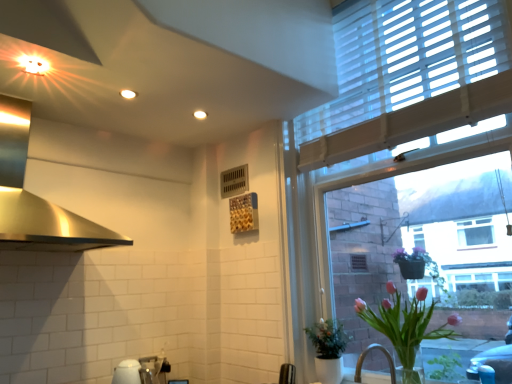
Where is `white glossy sink at lower center`? This screenshot has width=512, height=384. white glossy sink at lower center is located at coordinates (142, 371).

This screenshot has height=384, width=512. I want to click on white textured window at upper right, so click(x=411, y=156).

Describe the element at coordinates (405, 328) in the screenshot. I see `pink glass vase at lower right, marked as the second houseplant in a back-to-front arrangement` at that location.

The image size is (512, 384). In order to click on polished stainless steel exhaust hood at upper left in this screenshot , I will do `click(37, 198)`.

Is pink glass vase at lower right, marked as the second houseplant in a back-to-front arrangement, surrounded by polished stainless steel exhaust hood at upper left?

No, pink glass vase at lower right, marked as the second houseplant in a back-to-front arrangement, is located outside of polished stainless steel exhaust hood at upper left.

Who is more distant, polished stainless steel exhaust hood at upper left or pink glass vase at lower right, which is the first houseplant from front to back?

pink glass vase at lower right, which is the first houseplant from front to back, is further away from the camera.

Looking at this image, how many degrees apart are the facing directions of polished stainless steel exhaust hood at upper left and pink glass vase at lower right, which is the first houseplant from front to back?

The angular difference between polished stainless steel exhaust hood at upper left and pink glass vase at lower right, which is the first houseplant from front to back, is 88.5 degrees.

Considering the relative sizes of polished stainless steel exhaust hood at upper left and white glossy sink at lower center in the image provided, is polished stainless steel exhaust hood at upper left bigger than white glossy sink at lower center?

Yes.

Does polished stainless steel exhaust hood at upper left have a lesser width compared to white glossy sink at lower center?

No, polished stainless steel exhaust hood at upper left is not thinner than white glossy sink at lower center.

Does point (26, 216) come in front of point (161, 370)?

That is True.

From their relative heights in the image, would you say polished stainless steel exhaust hood at upper left is taller or shorter than white glossy sink at lower center?

Clearly, polished stainless steel exhaust hood at upper left is taller compared to white glossy sink at lower center.

Is pink glass vase at lower right, which is the first houseplant from front to back, spatially inside green matte plant at lower right, arranged as the first houseplant when viewed from the back, or outside of it?

pink glass vase at lower right, which is the first houseplant from front to back, is spatially situated outside green matte plant at lower right, arranged as the first houseplant when viewed from the back.

Which object is positioned more to the right, pink glass vase at lower right, which is the first houseplant from front to back, or green matte plant at lower right, the 2th houseplant viewed from the front?

pink glass vase at lower right, which is the first houseplant from front to back.

Could you tell me if pink glass vase at lower right, which is the first houseplant from front to back, is facing green matte plant at lower right, arranged as the first houseplant when viewed from the back?

No, pink glass vase at lower right, which is the first houseplant from front to back, does not turn towards green matte plant at lower right, arranged as the first houseplant when viewed from the back.

Considering the relative sizes of pink glass vase at lower right, which is the first houseplant from front to back, and green matte plant at lower right, arranged as the first houseplant when viewed from the back, in the image provided, is pink glass vase at lower right, which is the first houseplant from front to back, wider than green matte plant at lower right, arranged as the first houseplant when viewed from the back,?

Indeed, pink glass vase at lower right, which is the first houseplant from front to back, has a greater width compared to green matte plant at lower right, arranged as the first houseplant when viewed from the back.

The width and height of the screenshot is (512, 384). In order to click on window above the green matte plant at lower right, the 2th houseplant viewed from the front (from a real-world perspective) in this screenshot , I will do `click(411, 156)`.

From the image's perspective, is white textured window at upper right located above green matte plant at lower right, the 2th houseplant viewed from the front?

Yes, from the image's perspective, white textured window at upper right is above green matte plant at lower right, the 2th houseplant viewed from the front.

Does white textured window at upper right have a greater height compared to green matte plant at lower right, the 2th houseplant viewed from the front?

Correct, white textured window at upper right is much taller as green matte plant at lower right, the 2th houseplant viewed from the front.

Who is smaller, white textured window at upper right or green matte plant at lower right, arranged as the first houseplant when viewed from the back?

Smaller between the two is green matte plant at lower right, arranged as the first houseplant when viewed from the back.

Is pink glass vase at lower right, which is the first houseplant from front to back, bigger or smaller than polished stainless steel exhaust hood at upper left?

In the image, pink glass vase at lower right, which is the first houseplant from front to back, appears to be smaller than polished stainless steel exhaust hood at upper left.

Is pink glass vase at lower right, marked as the second houseplant in a back-to-front arrangement, in front of or behind polished stainless steel exhaust hood at upper left in the image?

Clearly, pink glass vase at lower right, marked as the second houseplant in a back-to-front arrangement, is behind polished stainless steel exhaust hood at upper left.

How many degrees apart are the facing directions of pink glass vase at lower right, marked as the second houseplant in a back-to-front arrangement, and polished stainless steel exhaust hood at upper left?

pink glass vase at lower right, marked as the second houseplant in a back-to-front arrangement, and polished stainless steel exhaust hood at upper left are facing 88.5 degrees away from each other.

Is green matte plant at lower right, the 2th houseplant viewed from the front, at the left side of white textured window at upper right?

Correct, you'll find green matte plant at lower right, the 2th houseplant viewed from the front, to the left of white textured window at upper right.

Does green matte plant at lower right, the 2th houseplant viewed from the front, turn towards white textured window at upper right?

Yes, green matte plant at lower right, the 2th houseplant viewed from the front, faces towards white textured window at upper right.

From the image's perspective, is green matte plant at lower right, the 2th houseplant viewed from the front, over white textured window at upper right?

No, from the image's perspective, green matte plant at lower right, the 2th houseplant viewed from the front, is not above white textured window at upper right.

Is white textured window at upper right located within green matte plant at lower right, the 2th houseplant viewed from the front?

No, white textured window at upper right is not inside green matte plant at lower right, the 2th houseplant viewed from the front.

Is green matte plant at lower right, arranged as the first houseplant when viewed from the back, touching polished stainless steel exhaust hood at upper left?

No, green matte plant at lower right, arranged as the first houseplant when viewed from the back, is not making contact with polished stainless steel exhaust hood at upper left.

From a real-world perspective, is green matte plant at lower right, the 2th houseplant viewed from the front, physically located above or below polished stainless steel exhaust hood at upper left?

green matte plant at lower right, the 2th houseplant viewed from the front, is situated lower than polished stainless steel exhaust hood at upper left in the real world.

Considering the sizes of objects green matte plant at lower right, arranged as the first houseplant when viewed from the back, and polished stainless steel exhaust hood at upper left in the image provided, who is taller, green matte plant at lower right, arranged as the first houseplant when viewed from the back, or polished stainless steel exhaust hood at upper left?

polished stainless steel exhaust hood at upper left.

Can you confirm if green matte plant at lower right, arranged as the first houseplant when viewed from the back, is smaller than polished stainless steel exhaust hood at upper left?

Yes.

Starting from the polished stainless steel exhaust hood at upper left, which houseplant is the 2nd one to the right? Please provide its 2D coordinates.

[(405, 328)]

This screenshot has height=384, width=512. Find the location of `exhaust hood on the left of white glossy sink at lower center`. exhaust hood on the left of white glossy sink at lower center is located at coordinates (37, 198).

When comparing their distances from white glossy sink at lower center, does pink glass vase at lower right, marked as the second houseplant in a back-to-front arrangement, or polished stainless steel exhaust hood at upper left seem further?

Among the two, pink glass vase at lower right, marked as the second houseplant in a back-to-front arrangement, is located further to white glossy sink at lower center.

In the scene shown: Looking at the image, which one is located further to polished stainless steel exhaust hood at upper left, green matte plant at lower right, the 2th houseplant viewed from the front, or white glossy sink at lower center?

green matte plant at lower right, the 2th houseplant viewed from the front, is further to polished stainless steel exhaust hood at upper left.

When comparing their distances from white textured window at upper right, does polished stainless steel exhaust hood at upper left or pink glass vase at lower right, which is the first houseplant from front to back, seem further?

Among the two, polished stainless steel exhaust hood at upper left is located further to white textured window at upper right.

Estimate the real-world distances between objects in this image. Which object is closer to white glossy sink at lower center, white textured window at upper right or polished stainless steel exhaust hood at upper left?

Based on the image, polished stainless steel exhaust hood at upper left appears to be nearer to white glossy sink at lower center.

When comparing their distances from white textured window at upper right, does pink glass vase at lower right, marked as the second houseplant in a back-to-front arrangement, or green matte plant at lower right, arranged as the first houseplant when viewed from the back, seem closer?

pink glass vase at lower right, marked as the second houseplant in a back-to-front arrangement, is positioned closer to the anchor white textured window at upper right.

Considering their positions, is polished stainless steel exhaust hood at upper left positioned further to white glossy sink at lower center than pink glass vase at lower right, marked as the second houseplant in a back-to-front arrangement?

Among the two, pink glass vase at lower right, marked as the second houseplant in a back-to-front arrangement, is located further to white glossy sink at lower center.

When comparing their distances from pink glass vase at lower right, which is the first houseplant from front to back, does green matte plant at lower right, arranged as the first houseplant when viewed from the back, or polished stainless steel exhaust hood at upper left seem closer?

green matte plant at lower right, arranged as the first houseplant when viewed from the back, lies closer to pink glass vase at lower right, which is the first houseplant from front to back, than the other object.

Based on their spatial positions, is white textured window at upper right or green matte plant at lower right, arranged as the first houseplant when viewed from the back, further from pink glass vase at lower right, marked as the second houseplant in a back-to-front arrangement?

Among the two, white textured window at upper right is located further to pink glass vase at lower right, marked as the second houseplant in a back-to-front arrangement.

Find the location of `sink between polished stainless steel exhaust hood at upper left and green matte plant at lower right, arranged as the first houseplant when viewed from the back, from left to right`. sink between polished stainless steel exhaust hood at upper left and green matte plant at lower right, arranged as the first houseplant when viewed from the back, from left to right is located at coordinates (142, 371).

The width and height of the screenshot is (512, 384). In order to click on houseplant that lies between white textured window at upper right and green matte plant at lower right, the 2th houseplant viewed from the front, from top to bottom in this screenshot , I will do `click(405, 328)`.

In order to click on sink situated between polished stainless steel exhaust hood at upper left and white textured window at upper right from left to right in this screenshot , I will do `click(142, 371)`.

Where is `houseplant between polished stainless steel exhaust hood at upper left and pink glass vase at lower right, marked as the second houseplant in a back-to-front arrangement, in the horizontal direction`? The image size is (512, 384). houseplant between polished stainless steel exhaust hood at upper left and pink glass vase at lower right, marked as the second houseplant in a back-to-front arrangement, in the horizontal direction is located at coordinates (328, 349).